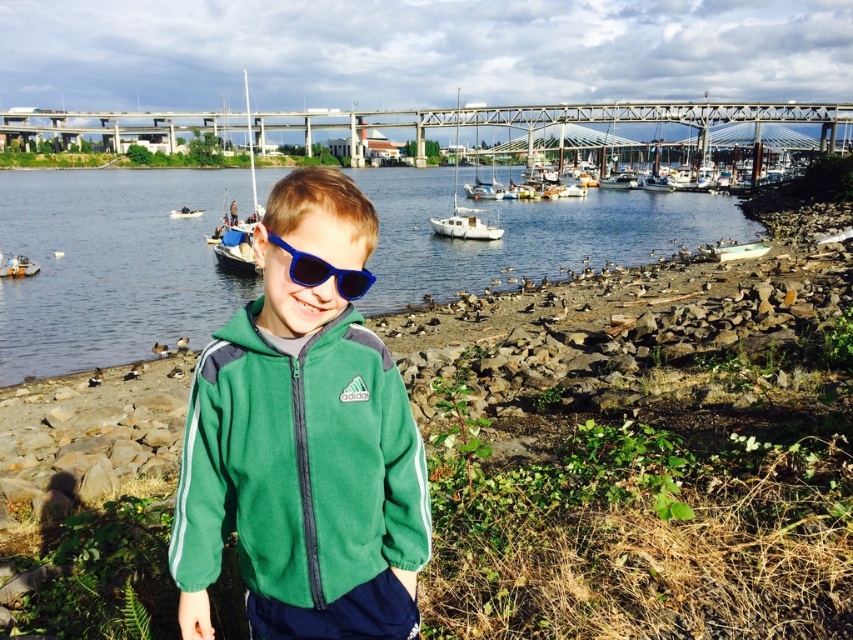
Based on the scene description, where is the white plastic sailboat at center located in terms of coordinates?

The white plastic sailboat at center is located at coordinates (241, 221).

You are a photographer positioned at the riverside and want to capture a photo of the green fleece jacket at center and the white plastic boat at left. Which object will appear larger in the photo?

The green fleece jacket at center will appear larger in the photo because it is closer to the viewer than the white plastic boat at left.

You are a toy collector who wants to display both the white plastic sailboat at center and the white plastic boat at center on a shelf. Which one should you place on the lower shelf to ensure they are displayed properly according to their sizes?

The white plastic boat at center should be placed on the lower shelf because the white plastic sailboat at center is taller and needs to be displayed higher to be fully visible.